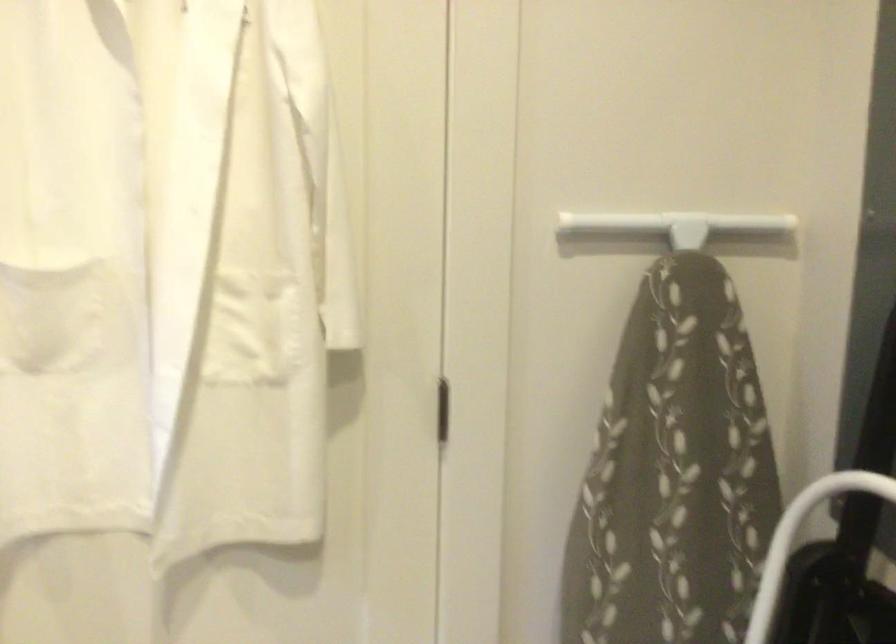
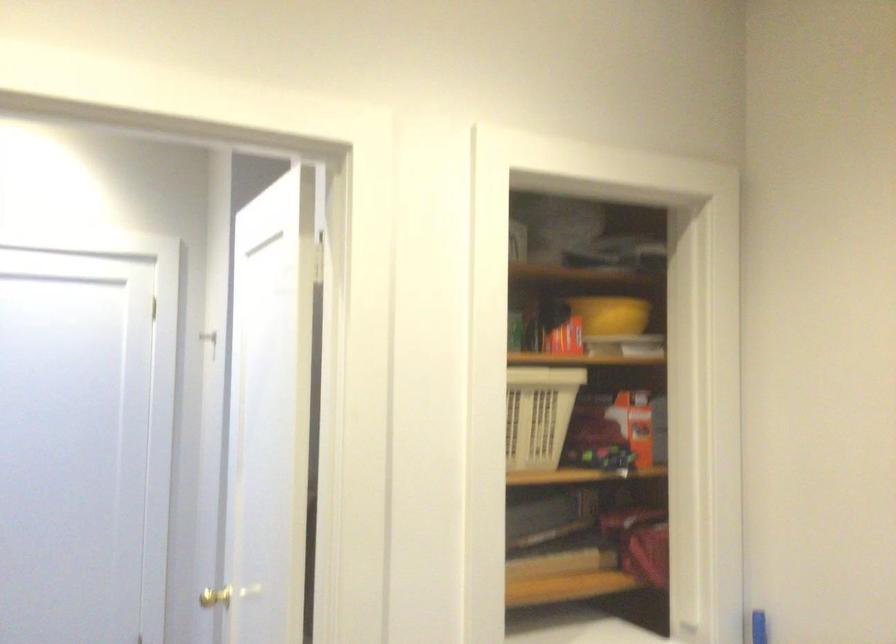
Question: The first image is from the beginning of the video and the second image is from the end. How did the camera likely rotate when shooting the video?

Choices:
 (A) Left
 (B) Right
 (C) Up
 (D) Down

Answer: (B)